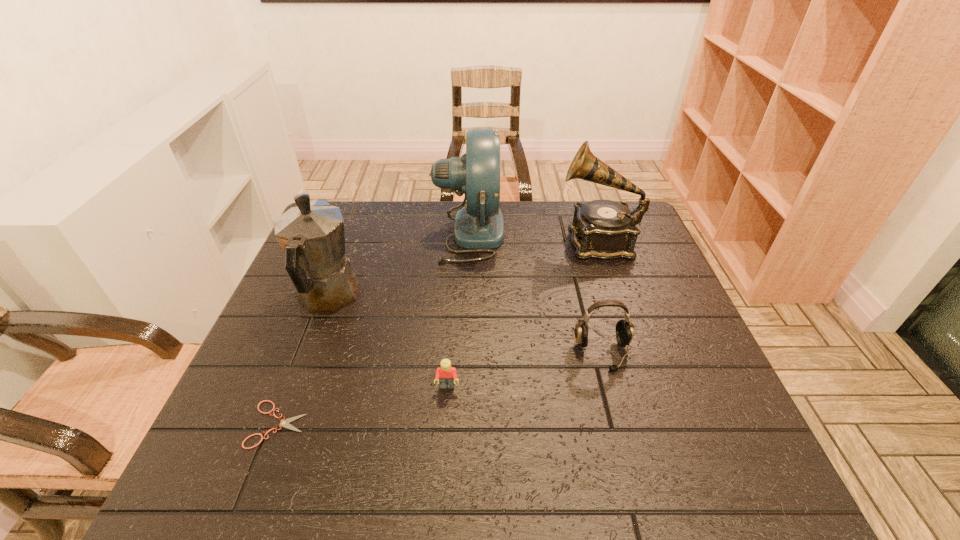
Find the location of a particular element. free space between the coffeepot and the phonograph record is located at coordinates (463, 269).

Locate an element on the screen. vacant space in between the fourth tallest object and the second shortest object is located at coordinates (525, 370).

Where is `empty location between the shortest object and the fan`? The height and width of the screenshot is (540, 960). empty location between the shortest object and the fan is located at coordinates (373, 329).

The height and width of the screenshot is (540, 960). Identify the location of unoccupied position between the fourth tallest object and the coffeepot. (466, 326).

Locate an element on the screen. free spot between the fan and the fourth tallest object is located at coordinates (536, 293).

Identify the location of free space between the nearest object and the phonograph record. Image resolution: width=960 pixels, height=540 pixels. (438, 332).

Where is `blank region between the fan and the fifth farthest object`? The height and width of the screenshot is (540, 960). blank region between the fan and the fifth farthest object is located at coordinates (458, 310).

Where is `empty space that is in between the fan and the coffeepot`? empty space that is in between the fan and the coffeepot is located at coordinates (398, 266).

Where is `vacant space that is in between the nearest object and the fan`? This screenshot has width=960, height=540. vacant space that is in between the nearest object and the fan is located at coordinates (373, 329).

Identify which object is located as the fourth nearest to the Lego. Please provide its 2D coordinates. Your answer should be formatted as a tuple, i.e. [(x, y)], where the tuple contains the x and y coordinates of a point satisfying the conditions above.

[(479, 226)]